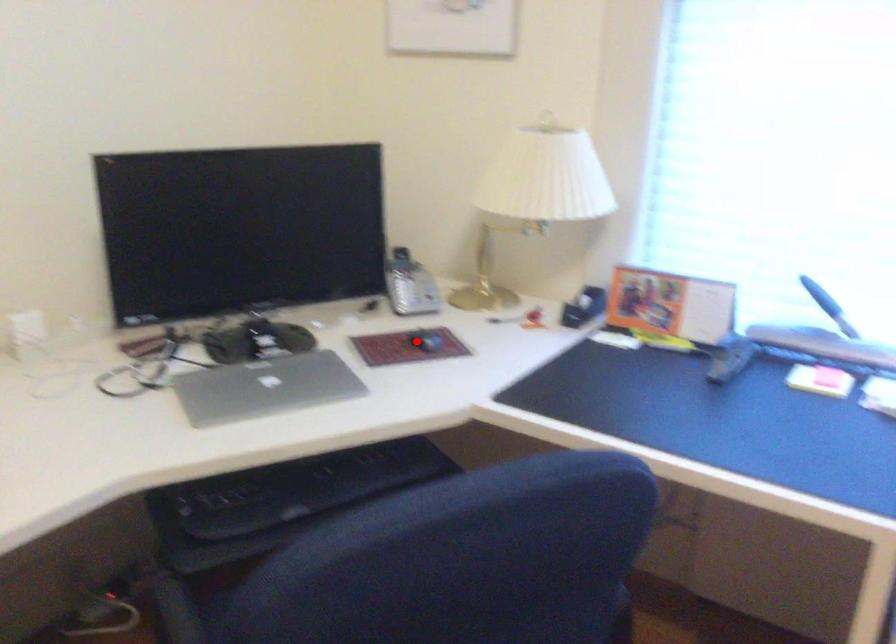
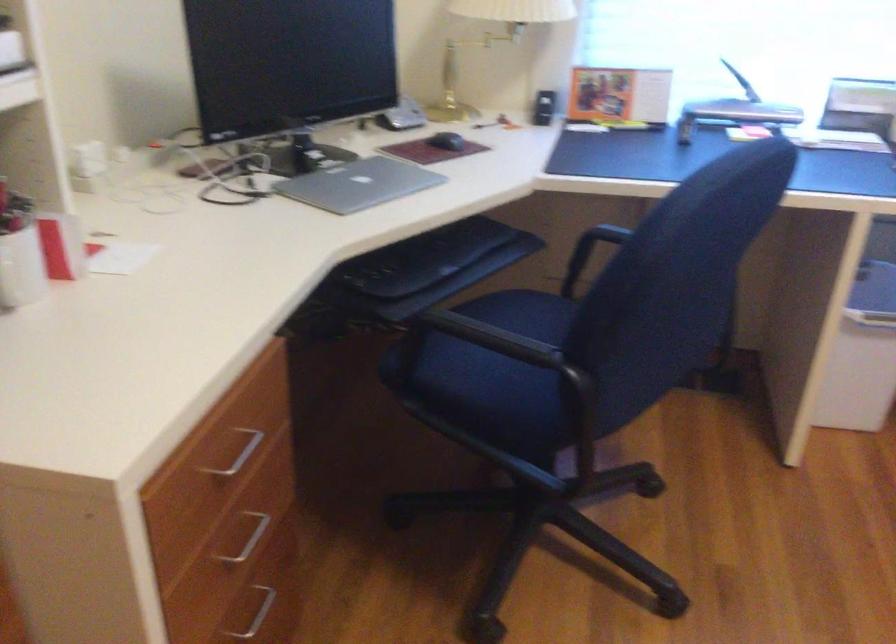
Find the pixel in the second image that matches the highlighted location in the first image.

(446, 140)